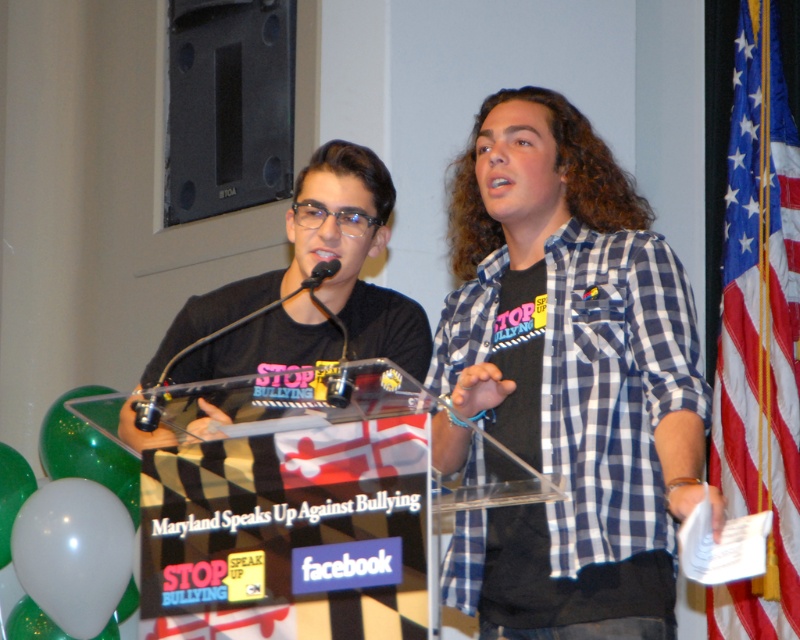
Is blue checkered shirt at center bigger than american flag at right?

Correct, blue checkered shirt at center is larger in size than american flag at right.

Between blue checkered shirt at center and american flag at right, which one is positioned lower?

blue checkered shirt at center is lower down.

This screenshot has width=800, height=640. What do you see at coordinates (568, 378) in the screenshot? I see `blue checkered shirt at center` at bounding box center [568, 378].

The image size is (800, 640). Identify the location of blue checkered shirt at center. (568, 378).

Is blue checkered shirt at center smaller than black plastic microphone at center?

No, blue checkered shirt at center is not smaller than black plastic microphone at center.

Is blue checkered shirt at center further to the viewer compared to black plastic microphone at center?

No, blue checkered shirt at center is in front of black plastic microphone at center.

At what (x,y) coordinates should I click in order to perform the action: click on blue checkered shirt at center. Please return your answer as a coordinate pair (x, y). This screenshot has width=800, height=640. Looking at the image, I should click on click(568, 378).

Does point (752, 257) come in front of point (320, 275)?

No, (752, 257) is behind (320, 275).

Between american flag at right and black plastic microphone at center, which one is positioned lower?

Positioned lower is american flag at right.

You are a GUI agent. You are given a task and a screenshot of the screen. Output one action in this format:
    pyautogui.click(x=<x>, y=<y>)
    Task: Click on the american flag at right
    The height and width of the screenshot is (640, 800).
    Given the screenshot: What is the action you would take?
    pyautogui.click(x=760, y=333)